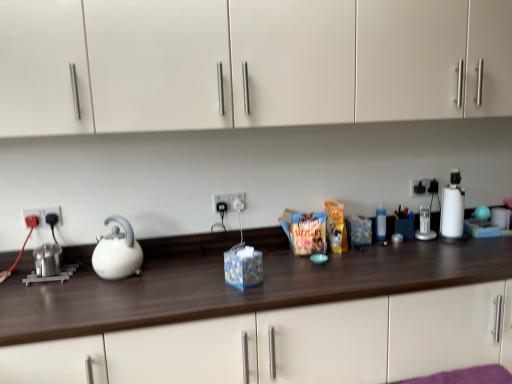
Question: Is white glossy kettle at left oriented towards wooden counter at center?

Choices:
 (A) yes
 (B) no

Answer: (B)

Question: Would you say wooden counter at center is part of white glossy kettle at left's contents?

Choices:
 (A) yes
 (B) no

Answer: (B)

Question: Does white glossy kettle at left have a lesser width compared to wooden counter at center?

Choices:
 (A) yes
 (B) no

Answer: (A)

Question: From a real-world perspective, is white glossy kettle at left located higher than wooden counter at center?

Choices:
 (A) no
 (B) yes

Answer: (B)

Question: Does white glossy kettle at left have a greater height compared to wooden counter at center?

Choices:
 (A) yes
 (B) no

Answer: (B)

Question: Does white glossy kettle at left appear on the right side of wooden counter at center?

Choices:
 (A) yes
 (B) no

Answer: (B)

Question: Is the depth of white matte cabinet at upper center greater than that of polished stainless steel kettle at left?

Choices:
 (A) yes
 (B) no

Answer: (B)

Question: Does white matte cabinet at upper center have a greater height compared to polished stainless steel kettle at left?

Choices:
 (A) yes
 (B) no

Answer: (A)

Question: Can you confirm if white matte cabinet at upper center is positioned to the left of polished stainless steel kettle at left?

Choices:
 (A) no
 (B) yes

Answer: (A)

Question: Is white matte cabinet at upper center next to polished stainless steel kettle at left?

Choices:
 (A) no
 (B) yes

Answer: (A)

Question: Is white matte cabinet at upper center positioned beyond the bounds of polished stainless steel kettle at left?

Choices:
 (A) no
 (B) yes

Answer: (B)

Question: Would you consider white matte cabinet at upper center to be distant from polished stainless steel kettle at left?

Choices:
 (A) no
 (B) yes

Answer: (B)

Question: Is white plastic blender at right facing towards polished stainless steel kettle at left?

Choices:
 (A) no
 (B) yes

Answer: (A)